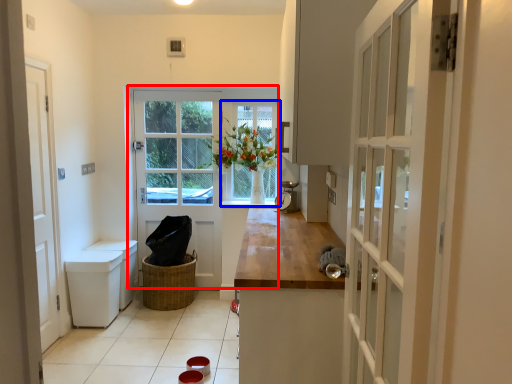
Question: Among these objects, which one is nearest to the camera, door (highlighted by a red box) or window (highlighted by a blue box)?

Choices:
 (A) door
 (B) window

Answer: (A)